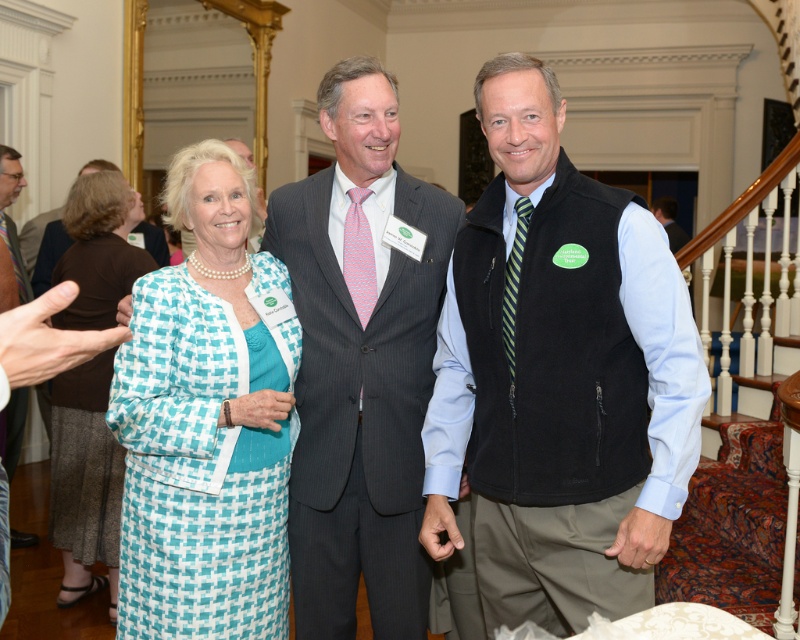
Question: Does teal houndstooth dress at center have a larger size compared to striped tie at left?

Choices:
 (A) no
 (B) yes

Answer: (B)

Question: Is black fleece vest at center positioned in front of teal houndstooth dress at center?

Choices:
 (A) no
 (B) yes

Answer: (B)

Question: Is gray pinstripe suit at center smaller than teal houndstooth dress at center?

Choices:
 (A) no
 (B) yes

Answer: (B)

Question: Which of the following is the closest to the observer?

Choices:
 (A) (282, 321)
 (B) (525, 618)
 (C) (324, 588)

Answer: (B)

Question: Which of the following is the farthest from the observer?

Choices:
 (A) gray pinstripe suit at center
 (B) striped tie at left
 (C) teal woven dress at left
 (D) black fleece vest at center

Answer: (B)

Question: Which of the following is the farthest from the observer?

Choices:
 (A) black fleece vest at center
 (B) teal woven dress at left

Answer: (B)